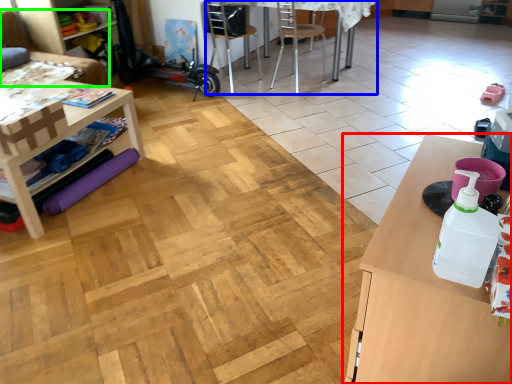
Question: Which object is the farthest from table (highlighted by a red box)? Choose among these: computer desk (highlighted by a blue box) or couch (highlighted by a green box).

Choices:
 (A) computer desk
 (B) couch

Answer: (B)